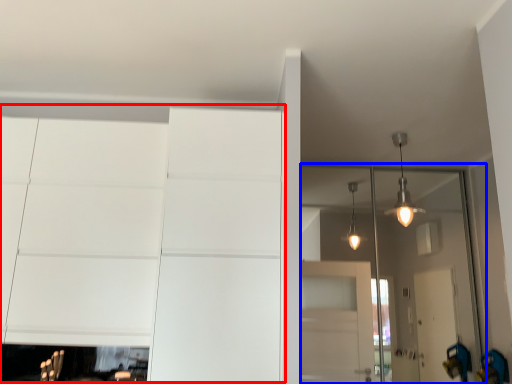
Question: Which point is closer to the camera, dresser (highlighted by a red box) or glass door (highlighted by a blue box)?

Choices:
 (A) dresser
 (B) glass door

Answer: (A)